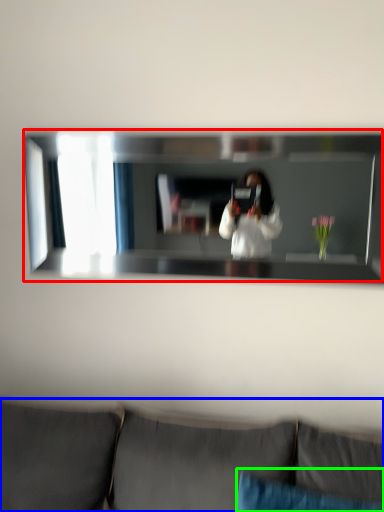
Question: Estimate the real-world distances between objects in this image. Which object is closer to mirror (highlighted by a red box), studio couch (highlighted by a blue box) or pillow (highlighted by a green box)?

Choices:
 (A) studio couch
 (B) pillow

Answer: (A)